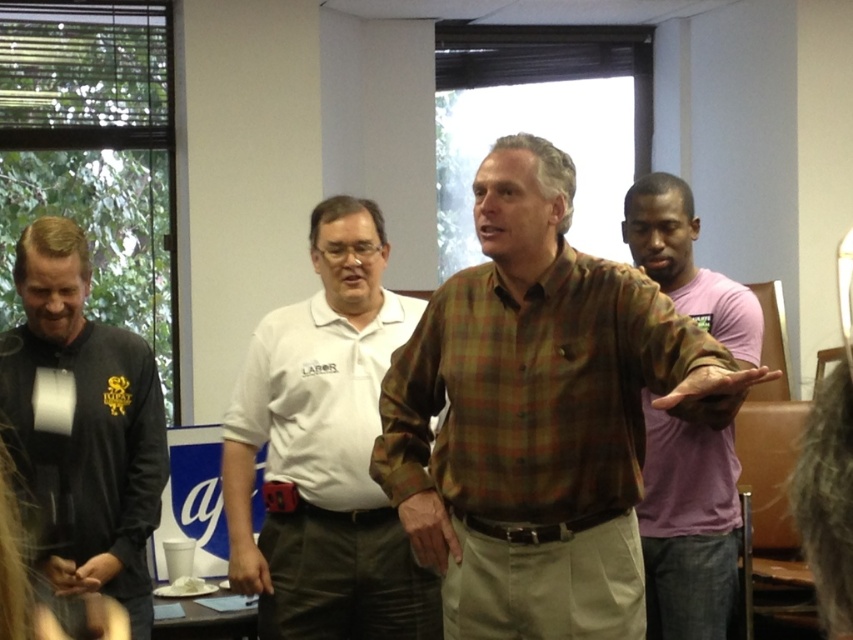
Question: Which of the following is the closest to the observer?

Choices:
 (A) (686, 595)
 (B) (490, 356)

Answer: (B)

Question: Is black matte polo shirt at left to the right of camo fabric shirt at right from the viewer's perspective?

Choices:
 (A) no
 (B) yes

Answer: (A)

Question: Considering the relative positions of plaid cotton shirt at center and camo fabric shirt at right in the image provided, where is plaid cotton shirt at center located with respect to camo fabric shirt at right?

Choices:
 (A) below
 (B) above

Answer: (B)

Question: Which is nearer to the plaid cotton shirt at center?

Choices:
 (A) black matte polo shirt at left
 (B) white cotton shirt at center

Answer: (B)

Question: Which point is farther to the camera?

Choices:
 (A) (428, 348)
 (B) (120, 465)

Answer: (B)

Question: Does plaid cotton shirt at center lie behind white cotton shirt at center?

Choices:
 (A) yes
 (B) no

Answer: (B)